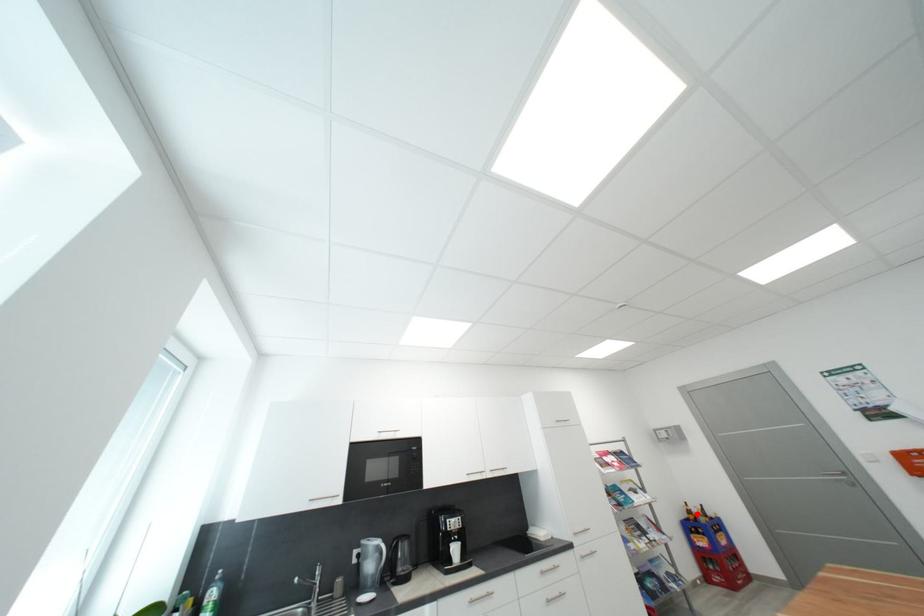
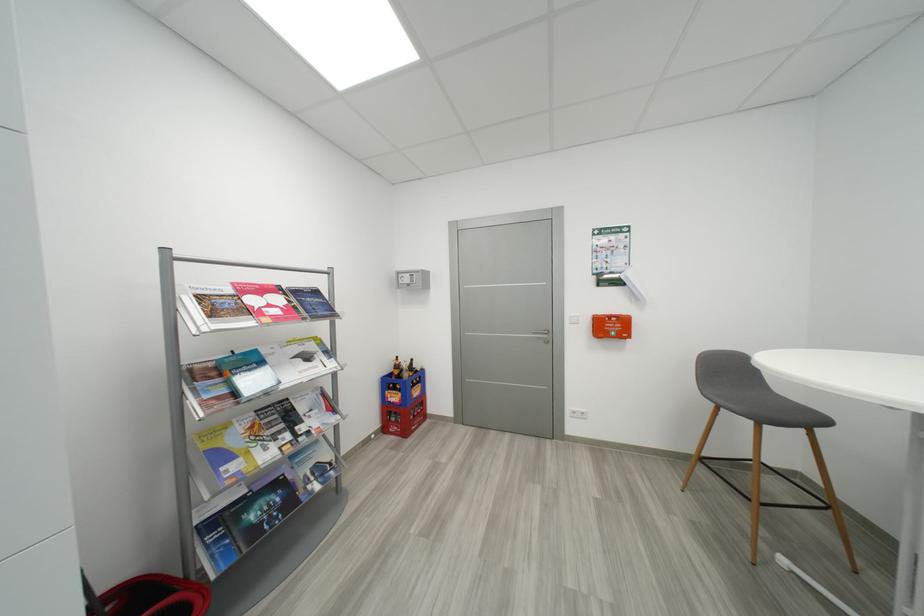
Question: I am providing you with two images of the same scene from different viewpoints. Image1 has a red point marked. In image2, the corresponding 3D location appears at what relative position? Reply with the corresponding letter.

Choices:
 (A) Closer
 (B) Farther

Answer: (B)